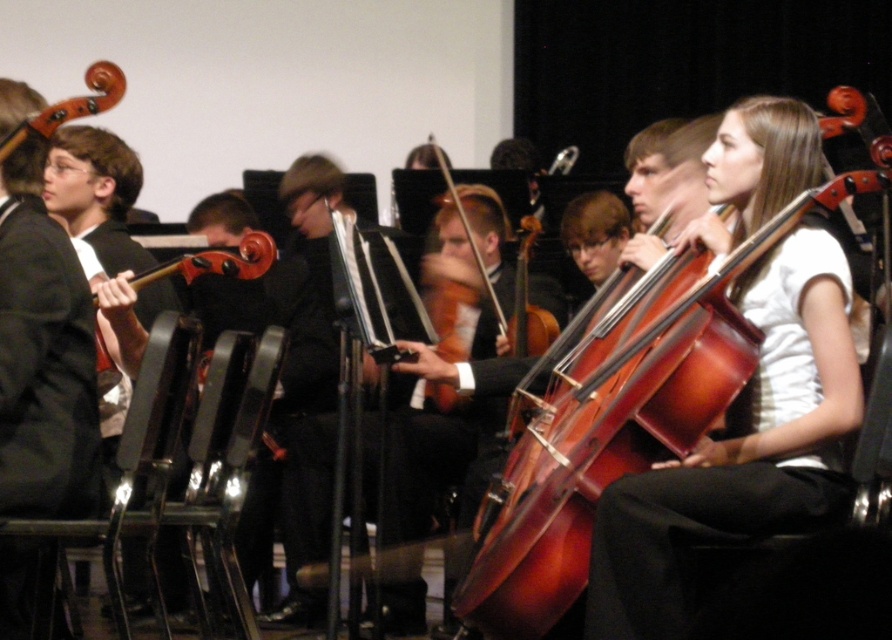
Question: Can you confirm if shiny brown cello at center is positioned above wooden violin at upper left?

Choices:
 (A) yes
 (B) no

Answer: (B)

Question: Which object is positioned farthest from the shiny black hat at center?

Choices:
 (A) shiny red violin at center
 (B) wooden violin at upper left

Answer: (B)

Question: Does shiny brown cello at center appear over shiny black hat at center?

Choices:
 (A) yes
 (B) no

Answer: (A)

Question: Can you confirm if shiny red violin at center is positioned below wooden violin at upper left?

Choices:
 (A) yes
 (B) no

Answer: (A)

Question: Which point is farther to the camera?

Choices:
 (A) shiny brown cello at center
 (B) shiny red violin at center
 (C) wooden violin at upper left

Answer: (B)

Question: Among these objects, which one is farthest from the camera?

Choices:
 (A) shiny black hat at center
 (B) wooden violin at upper left
 (C) shiny red violin at center

Answer: (A)